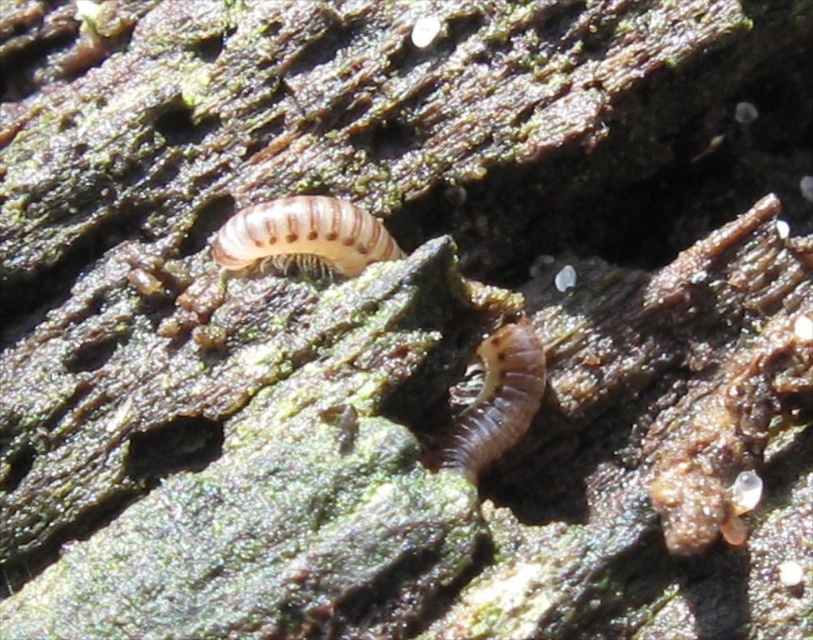
You are a scientist observing two millipedes on a decaying log. You notice a point marked at coordinates [303,236]. Which millipede is located at that point?

The point at coordinates [303,236] corresponds to the light brown striped millipede at center.

You are an entomologist observing two creatures on a decaying log. You need to determine which one is smaller in size. The creatures are the light brown striped millipede at center and the brown matte worm at center. Which one takes up less space?

The light brown striped millipede at center occupies less space than the brown matte worm at center, so the millipede is smaller in size.